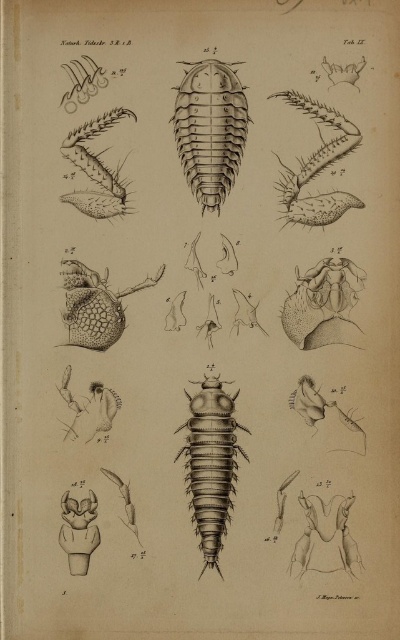
Is smooth black insect at center above gray metallic insect at center?

Correct, smooth black insect at center is located above gray metallic insect at center.

Can you confirm if smooth black insect at center is smaller than gray metallic insect at center?

Yes.

Between point (227, 100) and point (218, 435), which one is positioned in front?

Point (218, 435)

I want to click on smooth black insect at center, so click(210, 129).

Which of these two, gray metallic insect at center or smooth black insect at upper left, stands taller?

gray metallic insect at center is taller.

Does gray metallic insect at center have a lesser width compared to smooth black insect at upper left?

Indeed, gray metallic insect at center has a lesser width compared to smooth black insect at upper left.

This screenshot has width=400, height=640. What do you see at coordinates (210, 465) in the screenshot?
I see `gray metallic insect at center` at bounding box center [210, 465].

Locate an element on the screen. The image size is (400, 640). gray metallic insect at center is located at coordinates (210, 465).

Is smooth black insect at center to the left of smooth black insect at upper left from the viewer's perspective?

Incorrect, smooth black insect at center is not on the left side of smooth black insect at upper left.

Does smooth black insect at center have a lesser width compared to smooth black insect at upper left?

Incorrect, smooth black insect at center's width is not less than smooth black insect at upper left's.

Is point (206, 134) farther from viewer compared to point (84, 168)?

No, (206, 134) is in front of (84, 168).

Identify the location of smooth black insect at center. (210, 129).